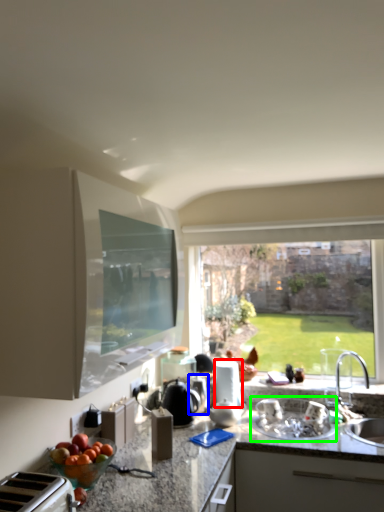
Question: Estimate the real-world distances between objects in this image. Which object is closer to appliance (highlighted by a red box), appliance (highlighted by a blue box) or sink (highlighted by a green box)?

Choices:
 (A) appliance
 (B) sink

Answer: (A)